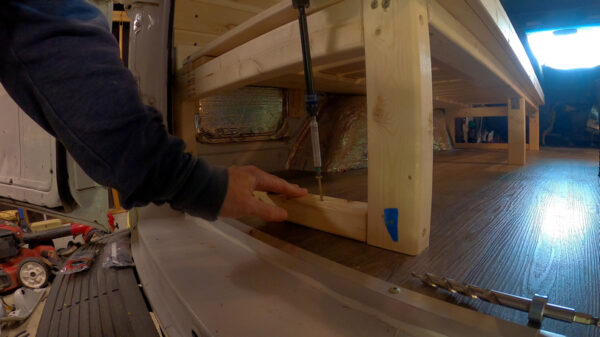
Where is `light`? This screenshot has height=337, width=600. light is located at coordinates (566, 56).